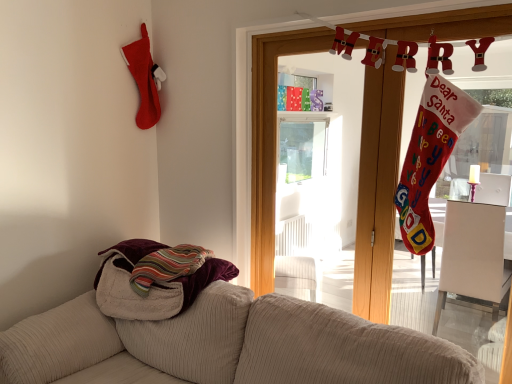
Question: From a real-world perspective, relative to beige corduroy couch at lower left, is striped cotton towel at lower left vertically above or below?

Choices:
 (A) above
 (B) below

Answer: (A)

Question: Is striped cotton towel at lower left inside or outside of beige corduroy couch at lower left?

Choices:
 (A) outside
 (B) inside

Answer: (B)

Question: Which object is the closest to the beige corduroy couch at lower left?

Choices:
 (A) wooden door at upper center
 (B) striped cotton towel at lower left

Answer: (B)

Question: Which of these objects is positioned closest to the wooden door at upper center?

Choices:
 (A) beige corduroy couch at lower left
 (B) striped cotton towel at lower left

Answer: (B)